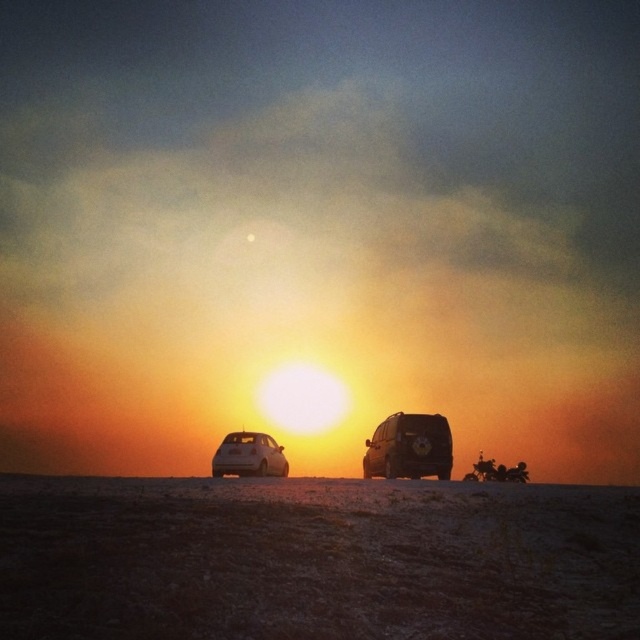
You are planning to take a road trip and need to choose between the shiny black suv at center and the white matte hatchback at lower left. Considering their sizes, which vehicle would be more suitable for carrying a large camping gear set?

The white matte hatchback at lower left is larger than the shiny black suv at center, making it more suitable for carrying a large camping gear set.

You are planning to park your car in this area and want to know if the shiny black suv at center can fit into a parking spot designed for the white matte hatchback at lower left. Based on their widths, will it fit?

The shiny black suv at center has a width less than the white matte hatchback at lower left, so it can fit into a parking spot designed for the white matte hatchback at lower left.